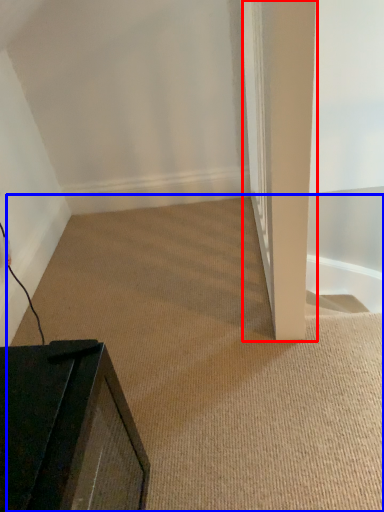
Question: Which point is closer to the camera, pillar (highlighted by a red box) or plain (highlighted by a blue box)?

Choices:
 (A) pillar
 (B) plain

Answer: (A)